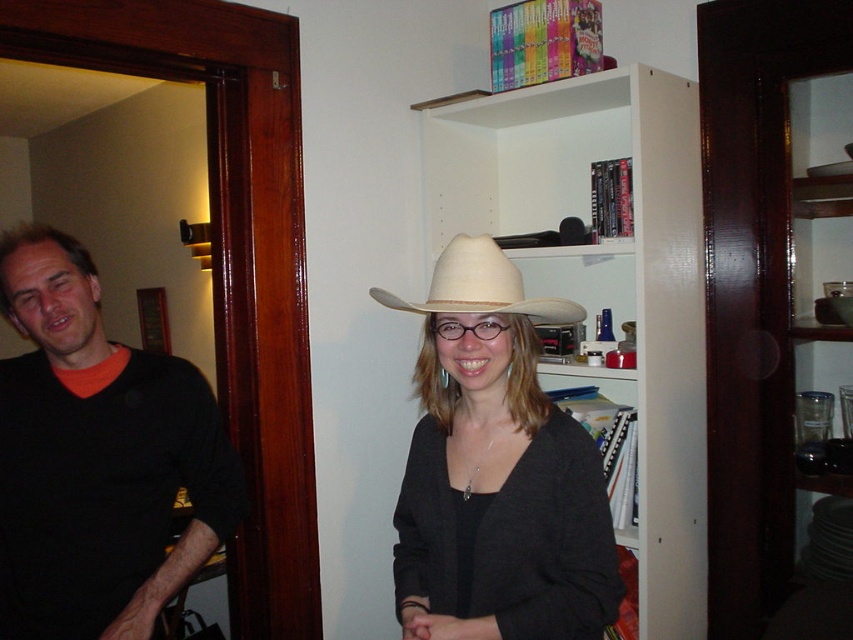
Is point (682, 515) positioned before point (573, 317)?

No, (682, 515) is further to viewer.

At what (x,y) coordinates should I click in order to perform the action: click on white matte bookshelf at upper center. Please return your answer as a coordinate pair (x, y). This screenshot has height=640, width=853. Looking at the image, I should click on (605, 278).

The width and height of the screenshot is (853, 640). Describe the element at coordinates (605, 278) in the screenshot. I see `white matte bookshelf at upper center` at that location.

Identify the location of white matte bookshelf at upper center. Image resolution: width=853 pixels, height=640 pixels. (605, 278).

From the picture: Is black matte sweater at left closer to camera compared to white straw hat at center?

No, it is behind white straw hat at center.

Is black matte sweater at left taller than white straw hat at center?

Correct, black matte sweater at left is much taller as white straw hat at center.

Which is behind, point (233, 529) or point (508, 269)?

The point (233, 529) is behind.

Locate an element on the screen. The image size is (853, 640). black matte sweater at left is located at coordinates (96, 458).

In the scene shown: Can you confirm if white matte bookshelf at upper center is taller than matte white cowboy hat at center?

Correct, white matte bookshelf at upper center is much taller as matte white cowboy hat at center.

Between white matte bookshelf at upper center and matte white cowboy hat at center, which one is positioned higher?

white matte bookshelf at upper center is above.

Who is more distant from viewer, (662, 166) or (523, 611)?

The point (662, 166) is more distant.

At what (x,y) coordinates should I click in order to perform the action: click on white matte bookshelf at upper center. Please return your answer as a coordinate pair (x, y). The image size is (853, 640). Looking at the image, I should click on (605, 278).